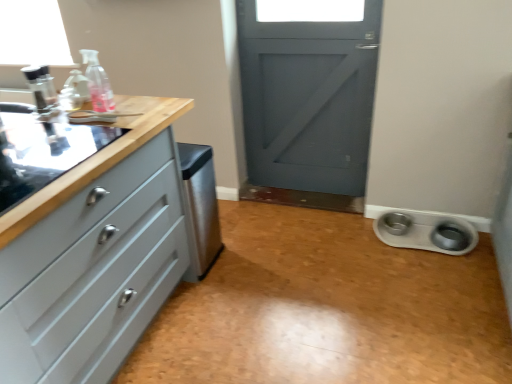
At what (x,y) coordinates should I click in order to perform the action: click on vacant area situated to the left side of white plastic pet bowls at lower right. Please return your answer as a coordinate pair (x, y). The image size is (512, 384). Looking at the image, I should click on (356, 246).